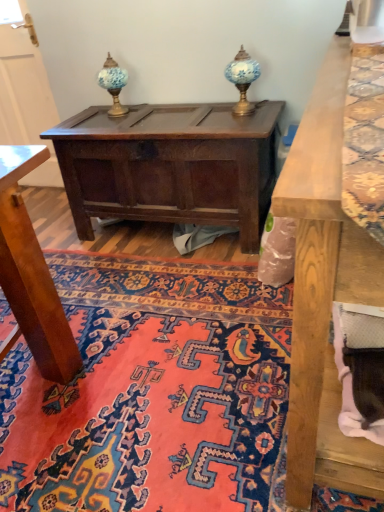
The height and width of the screenshot is (512, 384). In order to click on free location in front of blue glass table lamp at upper center, positioned as the 1th table lamp in right-to-left order in this screenshot , I will do `click(254, 119)`.